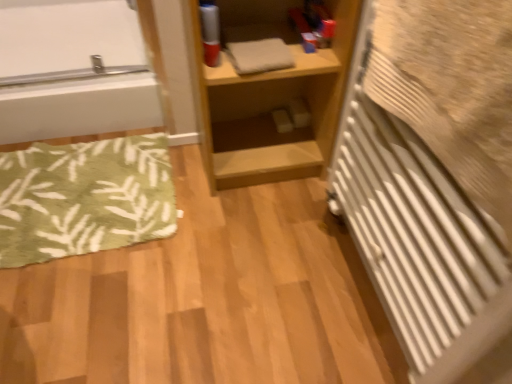
Question: In the image, is white glossy bathtub at upper left on the left side or the right side of light wood shelf at center?

Choices:
 (A) left
 (B) right

Answer: (A)

Question: From the image's perspective, is white glossy bathtub at upper left above or below light wood shelf at center?

Choices:
 (A) above
 (B) below

Answer: (A)

Question: Estimate the real-world distances between objects in this image. Which object is closer to the green leafy rug at lower left?

Choices:
 (A) white glossy bathtub at upper left
 (B) white textured radiator at right
 (C) light wood shelf at center

Answer: (A)

Question: Which object is the farthest from the white glossy bathtub at upper left?

Choices:
 (A) light wood shelf at center
 (B) white textured radiator at right
 (C) green leafy rug at lower left

Answer: (B)